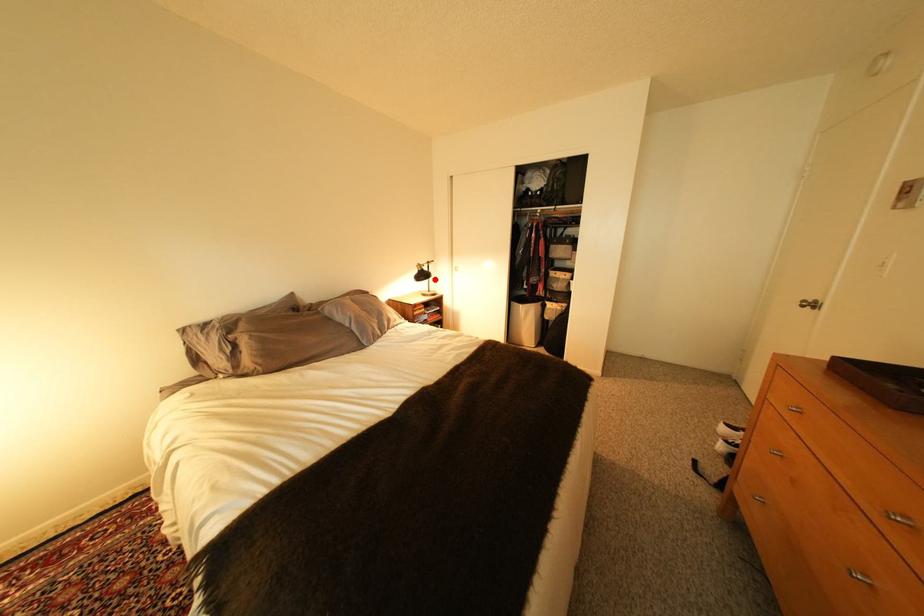
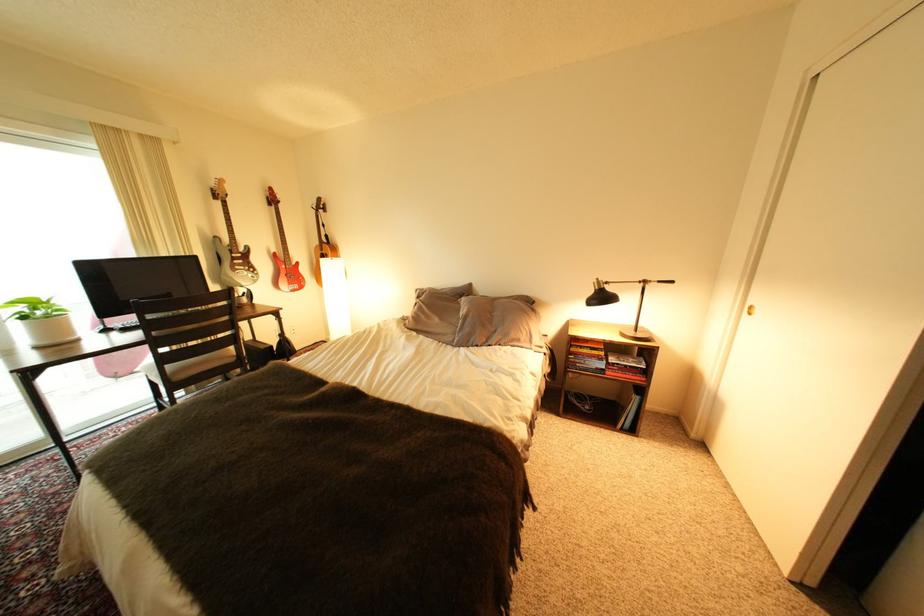
Where in the second image is the point corresponding to the highlighted location from the first image?

(608, 304)